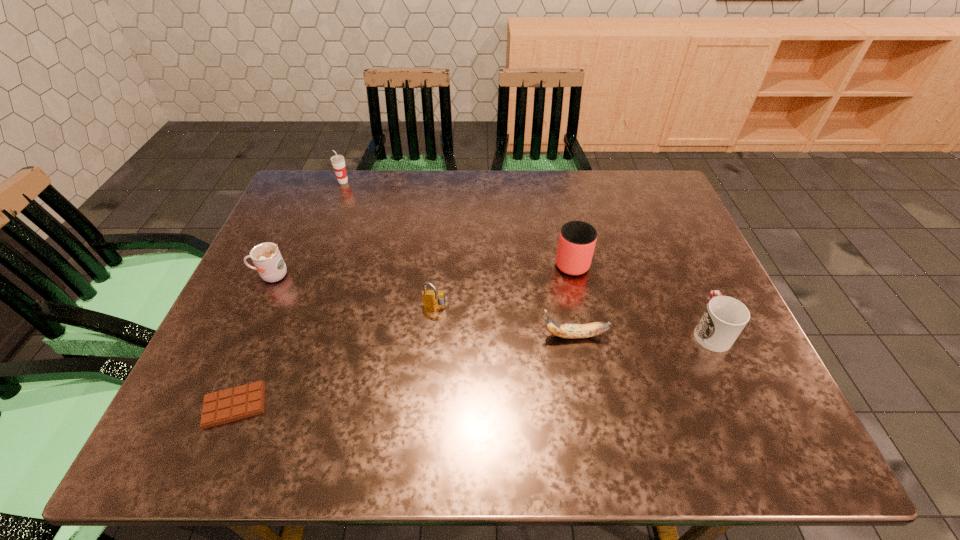
At what (x,y) coordinates should I click in order to perform the action: click on vacant space located on the side of the farthest cup with the logo. Please return your answer as a coordinate pair (x, y). Looking at the image, I should click on (324, 230).

This screenshot has height=540, width=960. Find the location of `vacant space positioned on the handle side of the third cup from left to right`. vacant space positioned on the handle side of the third cup from left to right is located at coordinates (556, 185).

In order to click on free space located 0.280m on the handle side of the third cup from left to right in this screenshot , I will do coord(556,185).

Where is `vacant region located on the handle side of the third cup from left to right`? Image resolution: width=960 pixels, height=540 pixels. vacant region located on the handle side of the third cup from left to right is located at coordinates (559, 200).

In order to click on blank space located on the handle side of the rightmost cup in this screenshot , I will do `click(682, 267)`.

Find the location of a particular element. The width and height of the screenshot is (960, 540). vacant area situated 0.290m on the handle side of the rightmost cup is located at coordinates (665, 232).

At what (x,y) coordinates should I click in order to perform the action: click on vacant space located on the handle side of the rightmost cup. Please return your answer as a coordinate pair (x, y). Looking at the image, I should click on (662, 225).

Locate an element on the screen. The width and height of the screenshot is (960, 540). vacant space located 0.140m on the side with the combination dials of the fourth object from left to right is located at coordinates (429, 364).

You are a GUI agent. You are given a task and a screenshot of the screen. Output one action in this format:
    pyautogui.click(x=<x>, y=<y>)
    Task: Click on the free space located 0.340m at the stem of the banana
    This screenshot has height=540, width=960.
    Given the screenshot: What is the action you would take?
    pyautogui.click(x=390, y=336)

Where is `vacant region located 0.380m at the stem of the banana`? This screenshot has height=540, width=960. vacant region located 0.380m at the stem of the banana is located at coordinates (372, 336).